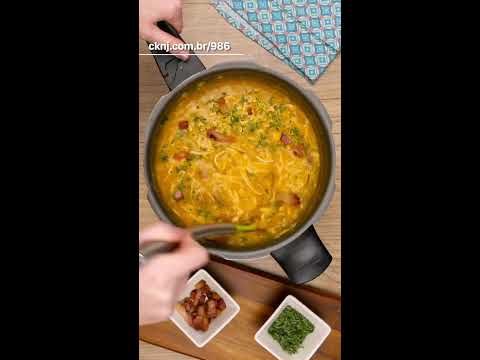
Where is `white square bowl bottom right`? white square bowl bottom right is located at coordinates (193, 332).